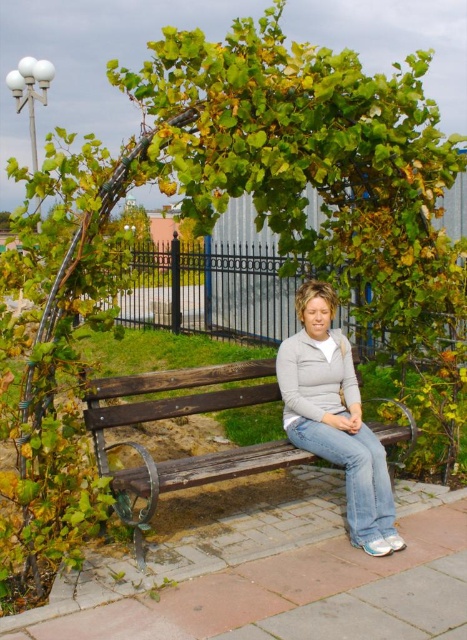
You are a painter standing in front of the wooden bench at center and the light gray fleece sweater at center. You need to paint both objects but want to know which one is shorter. Which one should you adjust your easel height for first?

The wooden bench at center is not as tall as the light gray fleece sweater at center, so you should adjust your easel height for the wooden bench at center first since it is shorter.

You are standing at the point with coordinates point (x=176, y=417). What object is located exactly at your current position?

The wooden bench at center is located exactly at point (x=176, y=417).

You are standing at the origin point of the coordinate system. You want to walk to the wooden bench at center. What are the coordinates you need to move to reach it?

The wooden bench at center is located at coordinates point (176, 417). So you need to move to coordinates point (176, 417) to reach it.